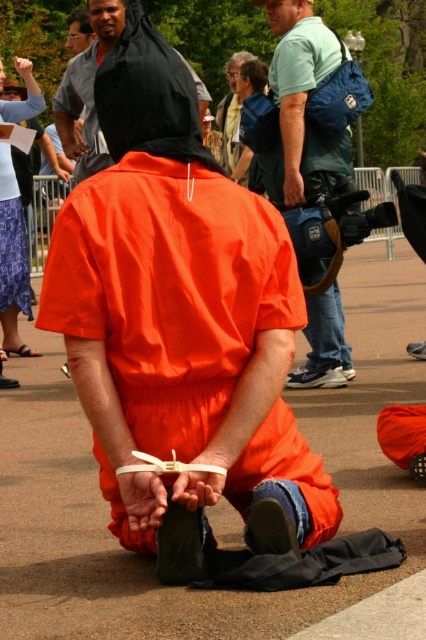
You are a photographer trying to capture a clear shot of the black matte hood at upper center and the smooth asphalt pavement at center. Which object is narrower in width?

The smooth asphalt pavement at center is thinner than the black matte hood at upper center, so the smooth asphalt pavement at center is narrower in width.

You are a photographer standing at the camera position. You want to capture a closeup shot of the central figure kneeling on the smooth asphalt pavement at center. Considering the distance between you and the pavement, will you need to adjust your camera settings for a clear closeup?

The distance between you and the smooth asphalt pavement at center is 12.85 feet. To capture a clear closeup, you may need to use a zoom lens or adjust your camera settings to ensure focus at that distance.

Based on the scene described, which object is positioned lower in the image between the orange matte jumpsuit at center and the smooth blue shirt at upper center?

The orange matte jumpsuit at center is located below the smooth blue shirt at upper center, so it is positioned lower in the image.